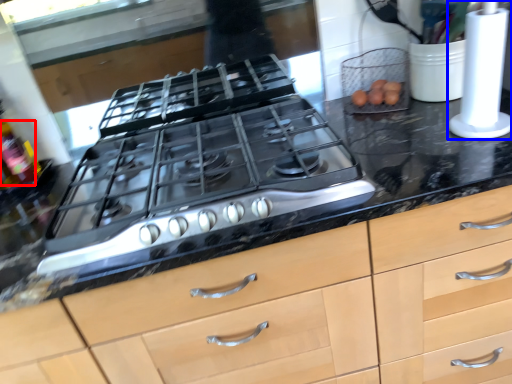
Question: Which object is further to the camera taking this photo, bottle (highlighted by a red box) or kitchen appliance (highlighted by a blue box)?

Choices:
 (A) bottle
 (B) kitchen appliance

Answer: (A)